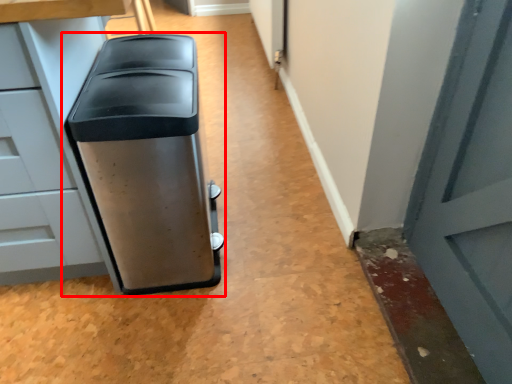
Question: In this image, where is waste container (annotated by the red box) located relative to cabinetry?

Choices:
 (A) right
 (B) left

Answer: (A)